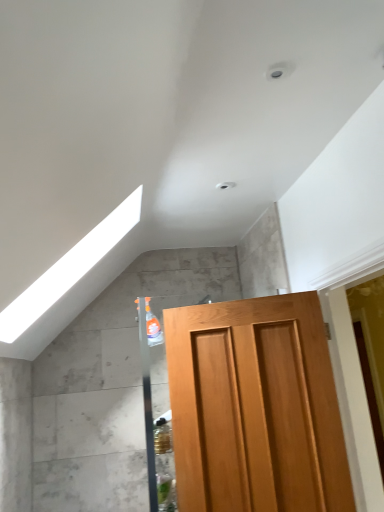
Question: Can you confirm if white glossy exhaust hood at upper left is smaller than light brown wooden door at center?

Choices:
 (A) no
 (B) yes

Answer: (A)

Question: From a real-world perspective, is white glossy exhaust hood at upper left physically below light brown wooden door at center?

Choices:
 (A) yes
 (B) no

Answer: (B)

Question: From the image's perspective, does white glossy exhaust hood at upper left appear higher than light brown wooden door at center?

Choices:
 (A) no
 (B) yes

Answer: (B)

Question: Is white glossy exhaust hood at upper left completely or partially outside of light brown wooden door at center?

Choices:
 (A) no
 (B) yes

Answer: (B)

Question: Considering the relative sizes of white glossy exhaust hood at upper left and light brown wooden door at center in the image provided, is white glossy exhaust hood at upper left taller than light brown wooden door at center?

Choices:
 (A) no
 (B) yes

Answer: (A)

Question: Can you confirm if white glossy exhaust hood at upper left is wider than light brown wooden door at center?

Choices:
 (A) no
 (B) yes

Answer: (B)

Question: Can you confirm if light brown wooden door at center is taller than white glossy exhaust hood at upper left?

Choices:
 (A) yes
 (B) no

Answer: (A)

Question: Is light brown wooden door at center outside white glossy exhaust hood at upper left?

Choices:
 (A) yes
 (B) no

Answer: (A)

Question: From the image's perspective, is light brown wooden door at center located beneath white glossy exhaust hood at upper left?

Choices:
 (A) yes
 (B) no

Answer: (A)

Question: Considering the relative sizes of light brown wooden door at center and white glossy exhaust hood at upper left in the image provided, is light brown wooden door at center wider than white glossy exhaust hood at upper left?

Choices:
 (A) yes
 (B) no

Answer: (B)

Question: Is light brown wooden door at center at the left side of white glossy exhaust hood at upper left?

Choices:
 (A) yes
 (B) no

Answer: (B)

Question: Is light brown wooden door at center positioned with its back to white glossy exhaust hood at upper left?

Choices:
 (A) no
 (B) yes

Answer: (A)

Question: In the image, is light brown wooden door at center on the left side or the right side of white glossy exhaust hood at upper left?

Choices:
 (A) right
 (B) left

Answer: (A)